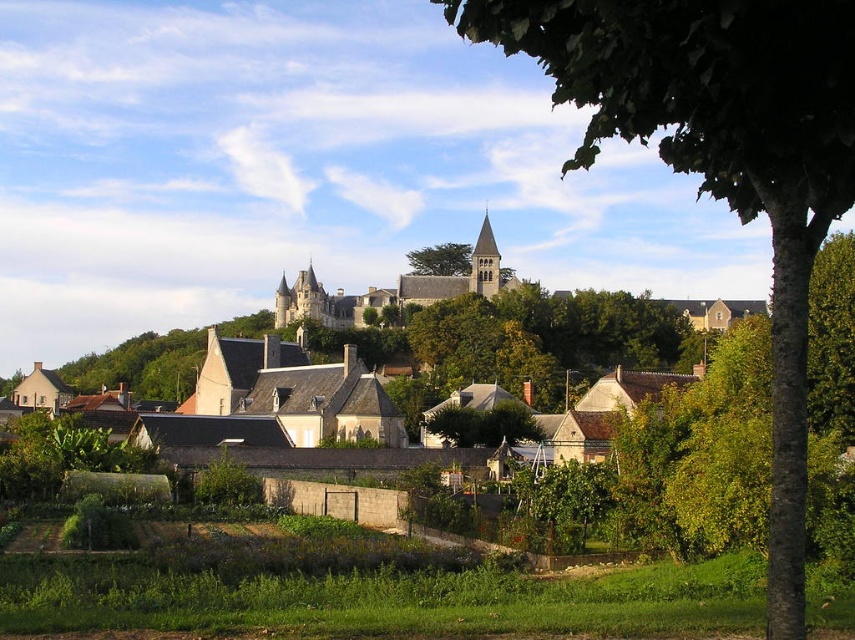
Question: Can you confirm if stone castle at center is positioned below green leafy tree at center?

Choices:
 (A) yes
 (B) no

Answer: (A)

Question: Which point is farther from the camera taking this photo?

Choices:
 (A) (452, 280)
 (B) (716, 90)
 (C) (425, 268)

Answer: (C)

Question: Which point appears closest to the camera in this image?

Choices:
 (A) (453, 278)
 (B) (775, 488)

Answer: (B)

Question: Which point is closer to the camera taking this photo?

Choices:
 (A) (x=451, y=291)
 (B) (x=802, y=44)

Answer: (B)

Question: Is green leafy tree at upper right to the left of stone castle at center from the viewer's perspective?

Choices:
 (A) no
 (B) yes

Answer: (A)

Question: Does green leafy tree at upper right have a smaller size compared to stone castle at center?

Choices:
 (A) yes
 (B) no

Answer: (B)